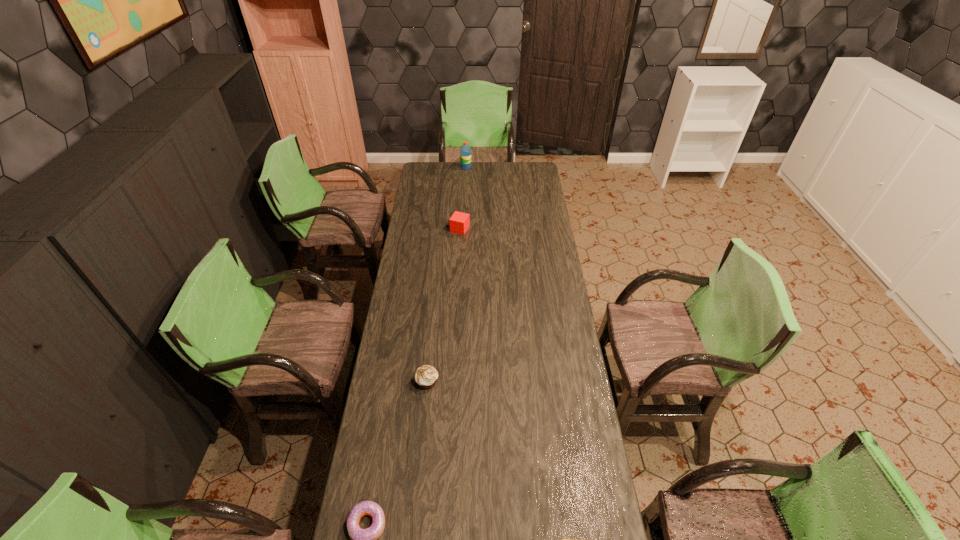
The width and height of the screenshot is (960, 540). What are the coordinates of `the tallest object` in the screenshot? It's located at (465, 150).

Find the location of a particular element. This screenshot has width=960, height=540. water bottle is located at coordinates point(465,150).

You are a GUI agent. You are given a task and a screenshot of the screen. Output one action in this format:
    pyautogui.click(x=<x>, y=<y>)
    Task: Click on the cube
    This screenshot has width=960, height=540.
    Given the screenshot: What is the action you would take?
    pyautogui.click(x=459, y=222)

The image size is (960, 540). Identify the location of the third farthest object. (426, 376).

Where is `vacant space located 0.090m on the front label of the farthest object`? The width and height of the screenshot is (960, 540). vacant space located 0.090m on the front label of the farthest object is located at coordinates [x=486, y=167].

Image resolution: width=960 pixels, height=540 pixels. I want to click on vacant space situated 0.110m on the right of the second farthest object, so click(x=491, y=229).

Image resolution: width=960 pixels, height=540 pixels. Find the location of `vacant space situated 0.080m on the front of the muffin`. vacant space situated 0.080m on the front of the muffin is located at coordinates (424, 413).

You are a GUI agent. You are given a task and a screenshot of the screen. Output one action in this format:
    pyautogui.click(x=<x>, y=<y>)
    Task: Click on the object positioned at the far edge
    
    Given the screenshot: What is the action you would take?
    pyautogui.click(x=465, y=150)

Locate an element on the screen. The image size is (960, 540). object situated at the left edge is located at coordinates 426,376.

Identify the location of free space at the far edge. Image resolution: width=960 pixels, height=540 pixels. (478, 180).